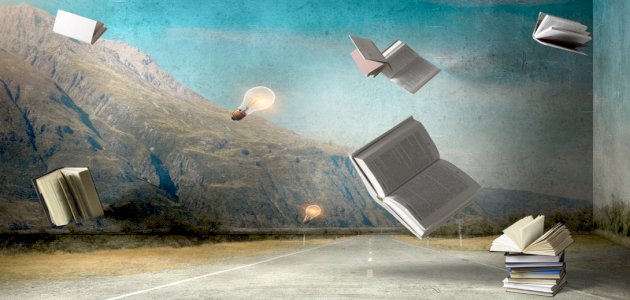
The height and width of the screenshot is (300, 630). In order to click on right wall in this screenshot , I will do `click(609, 186)`.